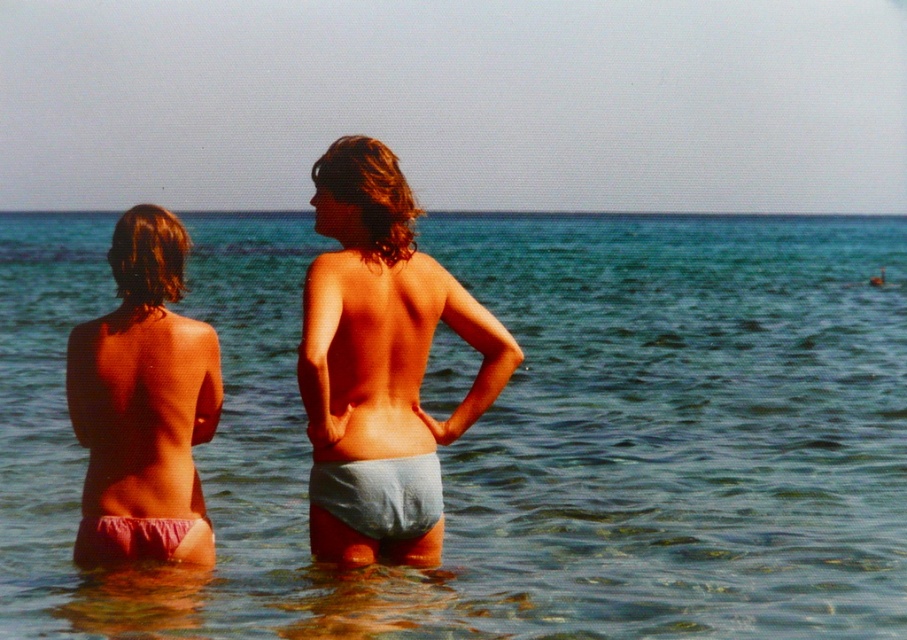
Who is positioned more to the left, clear blue water at center or pink fabric bikini bottom at left?

pink fabric bikini bottom at left is more to the left.

Can you confirm if clear blue water at center is wider than pink fabric bikini bottom at left?

Yes, clear blue water at center is wider than pink fabric bikini bottom at left.

Find the location of a particular element. clear blue water at center is located at coordinates (511, 435).

You are a GUI agent. You are given a task and a screenshot of the screen. Output one action in this format:
    pyautogui.click(x=<x>, y=<y>)
    Task: Click on the clear blue water at center
    The image size is (907, 640).
    Given the screenshot: What is the action you would take?
    pyautogui.click(x=511, y=435)

Does light blue fabric shorts at center lie behind pink fabric bikini at lower left?

No, light blue fabric shorts at center is in front of pink fabric bikini at lower left.

Is point (428, 528) farther from camera compared to point (91, 525)?

Yes, point (428, 528) is behind point (91, 525).

Where is `light blue fabric shorts at center`? light blue fabric shorts at center is located at coordinates (379, 358).

Between point (788, 378) and point (109, 531), which one is positioned in front?

Point (109, 531) is in front.

From the picture: Measure the distance between clear blue water at center and pink fabric bikini at lower left.

The distance of clear blue water at center from pink fabric bikini at lower left is 17.51 meters.

Image resolution: width=907 pixels, height=640 pixels. Identify the location of clear blue water at center. (511, 435).